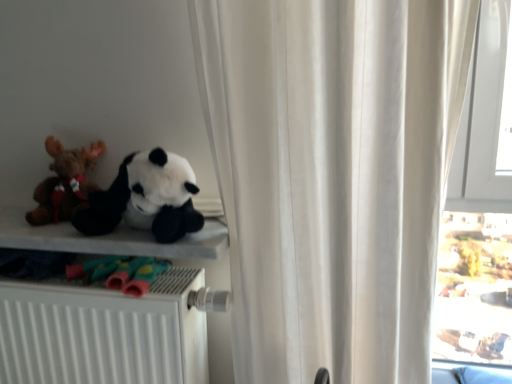
Where is `transparent glass window at right`? Image resolution: width=512 pixels, height=384 pixels. transparent glass window at right is located at coordinates (478, 214).

What do you see at coordinates (478, 214) in the screenshot? The height and width of the screenshot is (384, 512). I see `transparent glass window at right` at bounding box center [478, 214].

Identify the location of white matte radiator at lower left. The width and height of the screenshot is (512, 384). (103, 333).

Identify the location of soft plush panda at left, the second toy viewed from the left. (146, 198).

Where is `brown plush toy at left, the second toy when ordered from right to left`? brown plush toy at left, the second toy when ordered from right to left is located at coordinates (65, 183).

In order to click on white fabric curtain at upper center in this screenshot , I will do `click(332, 176)`.

From the image's perspective, is soft fabric shelf at left below white matte radiator at lower left?

No, from the image's perspective, soft fabric shelf at left is not below white matte radiator at lower left.

Does point (200, 247) appear closer or farther from the camera than point (193, 336)?

Point (200, 247).

Between soft fabric shelf at left and white matte radiator at lower left, which one appears on the left side from the viewer's perspective?

white matte radiator at lower left is more to the left.

Which object is positioned more to the right, soft fabric shelf at left or soft plush panda at left, which is the first toy from right to left?

soft plush panda at left, which is the first toy from right to left.

Does soft fabric shelf at left lie behind soft plush panda at left, the second toy viewed from the left?

That is True.

Considering the sizes of soft fabric shelf at left and soft plush panda at left, which is the first toy from right to left, in the image, is soft fabric shelf at left wider or thinner than soft plush panda at left, which is the first toy from right to left,?

In the image, soft fabric shelf at left appears to be wider than soft plush panda at left, which is the first toy from right to left.

Measure the distance between soft fabric shelf at left and soft plush panda at left, which is the first toy from right to left.

9.04 centimeters.

Is soft fabric shelf at left a part of white fabric curtain at upper center?

Definitely not — soft fabric shelf at left is not inside white fabric curtain at upper center.

In the scene shown: Which is more to the left, white fabric curtain at upper center or soft fabric shelf at left?

soft fabric shelf at left is more to the left.

Based on the photo, considering the relative sizes of white fabric curtain at upper center and soft fabric shelf at left in the image provided, is white fabric curtain at upper center wider than soft fabric shelf at left?

Indeed, white fabric curtain at upper center has a greater width compared to soft fabric shelf at left.

Considering the sizes of transparent glass window at right and white fabric curtain at upper center in the image, is transparent glass window at right wider or thinner than white fabric curtain at upper center?

Considering their sizes, transparent glass window at right looks slimmer than white fabric curtain at upper center.

Who is more distant, transparent glass window at right or white fabric curtain at upper center?

transparent glass window at right is behind.

Where is `window below the white fabric curtain at upper center (from a real-world perspective)`? window below the white fabric curtain at upper center (from a real-world perspective) is located at coordinates (478, 214).

Is transparent glass window at right smaller than white fabric curtain at upper center?

Yes.

From the image's perspective, is transparent glass window at right located above or below white matte radiator at lower left?

transparent glass window at right is above white matte radiator at lower left.

Which point is more forward, [481,60] or [186,338]?

Positioned in front is point [186,338].

How distant is transparent glass window at right from white matte radiator at lower left?

transparent glass window at right is 1.87 meters from white matte radiator at lower left.

You are a GUI agent. You are given a task and a screenshot of the screen. Output one action in this format:
    pyautogui.click(x=<x>, y=<y>)
    Task: Click on the window lying behind the white matte radiator at lower left
    This screenshot has width=512, height=384.
    Given the screenshot: What is the action you would take?
    pyautogui.click(x=478, y=214)

Considering the points (184, 274) and (113, 197), which point is in front, point (184, 274) or point (113, 197)?

The point (113, 197) is closer to the camera.

In the scene shown: Is white matte radiator at lower left placed right next to soft plush panda at left, the second toy viewed from the left?

No.

Does white matte radiator at lower left appear on the right side of soft plush panda at left, which is the first toy from right to left?

No, white matte radiator at lower left is not to the right of soft plush panda at left, which is the first toy from right to left.

From a real-world perspective, does white matte radiator at lower left sit lower than soft plush panda at left, which is the first toy from right to left?

Yes, from a real-world perspective, white matte radiator at lower left is beneath soft plush panda at left, which is the first toy from right to left.

Which is more to the right, white fabric curtain at upper center or transparent glass window at right?

From the viewer's perspective, transparent glass window at right appears more on the right side.

From the image's perspective, relative to transparent glass window at right, is white fabric curtain at upper center above or below?

Clearly, from the image's perspective, white fabric curtain at upper center is below transparent glass window at right.

Considering the sizes of white fabric curtain at upper center and transparent glass window at right in the image, is white fabric curtain at upper center taller or shorter than transparent glass window at right?

Considering their sizes, white fabric curtain at upper center has less height than transparent glass window at right.

Between white fabric curtain at upper center and transparent glass window at right, which one has larger size?

white fabric curtain at upper center is bigger.

Where is `radiator below the soft fabric shelf at left (from a real-world perspective)`? radiator below the soft fabric shelf at left (from a real-world perspective) is located at coordinates (103, 333).

This screenshot has height=384, width=512. I want to click on toy in front of the soft fabric shelf at left, so click(146, 198).

Based on the photo, estimate the real-world distances between objects in this image. Which object is closer to white fabric curtain at upper center, soft plush panda at left, which is the first toy from right to left, or white matte radiator at lower left?

Among the two, soft plush panda at left, which is the first toy from right to left, is located nearer to white fabric curtain at upper center.

Looking at the image, which one is located further to transparent glass window at right, white fabric curtain at upper center or brown plush toy at left, the second toy when ordered from right to left?

brown plush toy at left, the second toy when ordered from right to left.

Looking at the image, which one is located further to transparent glass window at right, white matte radiator at lower left or brown plush toy at left, the second toy when ordered from right to left?

Based on the image, brown plush toy at left, the second toy when ordered from right to left, appears to be further to transparent glass window at right.

Based on their spatial positions, is soft plush panda at left, which is the first toy from right to left, or white matte radiator at lower left further from soft fabric shelf at left?

white matte radiator at lower left is further to soft fabric shelf at left.

When comparing their distances from transparent glass window at right, does white matte radiator at lower left or soft plush panda at left, which is the first toy from right to left, seem closer?

Based on the image, soft plush panda at left, which is the first toy from right to left, appears to be nearer to transparent glass window at right.

Based on their spatial positions, is brown plush toy at left, which appears as the first toy when viewed from the left, or white fabric curtain at upper center closer to transparent glass window at right?

white fabric curtain at upper center is positioned closer to the anchor transparent glass window at right.

Considering their positions, is transparent glass window at right positioned further to white matte radiator at lower left than soft plush panda at left, the second toy viewed from the left?

transparent glass window at right.

Considering their positions, is white matte radiator at lower left positioned further to soft plush panda at left, the second toy viewed from the left, than white fabric curtain at upper center?

Among the two, white fabric curtain at upper center is located further to soft plush panda at left, the second toy viewed from the left.

Image resolution: width=512 pixels, height=384 pixels. What are the coordinates of `toy between soft fabric shelf at left and transparent glass window at right` in the screenshot? It's located at (146, 198).

Identify the location of shelf between soft plush panda at left, the second toy viewed from the left, and white matte radiator at lower left vertically. (109, 239).

The height and width of the screenshot is (384, 512). In order to click on toy situated between soft fabric shelf at left and white fabric curtain at upper center from left to right in this screenshot , I will do `click(146, 198)`.

Locate an element on the screen. This screenshot has width=512, height=384. curtain between soft fabric shelf at left and transparent glass window at right is located at coordinates pos(332,176).